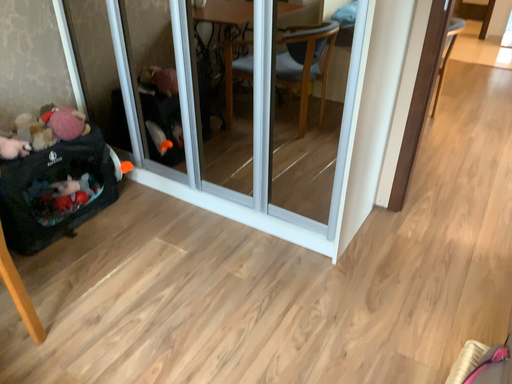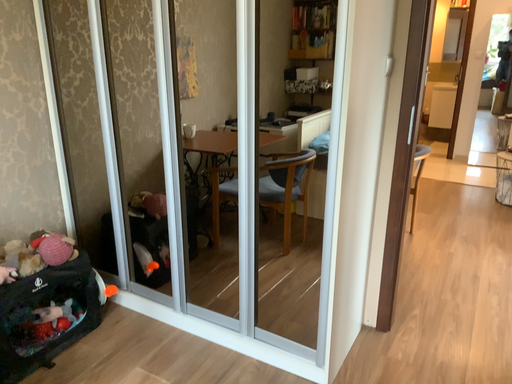
Question: Which way did the camera rotate in the video?

Choices:
 (A) rotated downward
 (B) rotated upward

Answer: (B)